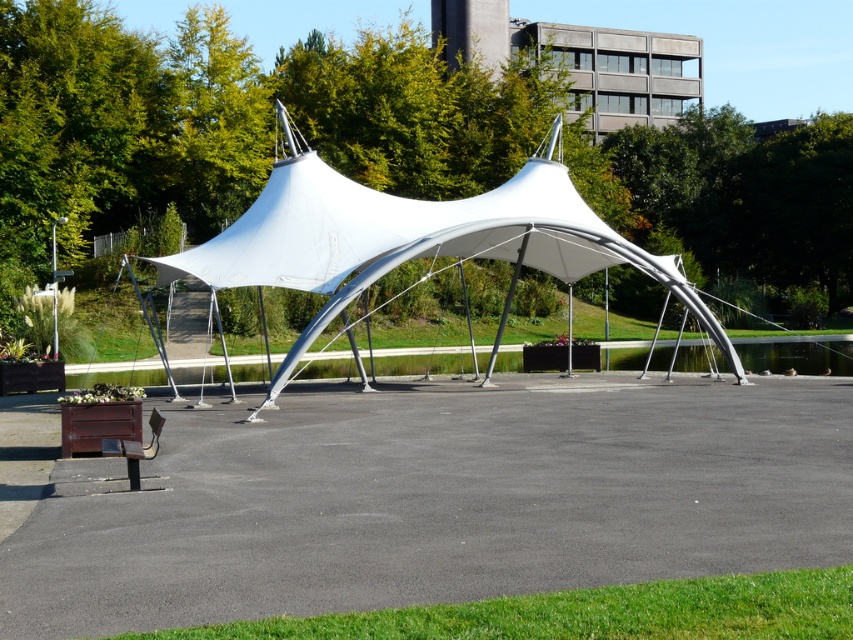
You are planning to install a new lighting system for the white fabric tent at center and the wooden park bench at lower left. The lighting fixtures for the tent require a minimum height of 3 meters to be effective. Can the tent accommodate the lighting fixtures?

The white fabric tent at center is taller than the wooden park bench at lower left, but the specific height of the tent is not provided. Therefore, it is uncertain if it meets the 3 meter requirement for the lighting fixtures.

You are planning to set up a picnic and need to choose between the white fabric tent at center and the wooden park bench at lower left. Based on their positions, which one is closer to the paved area where you can easily access your car parked nearby?

The wooden park bench at lower left is closer to the paved area where the car is parked since the white fabric tent at center is positioned to the right of it, placing the bench nearer to the parking spot.